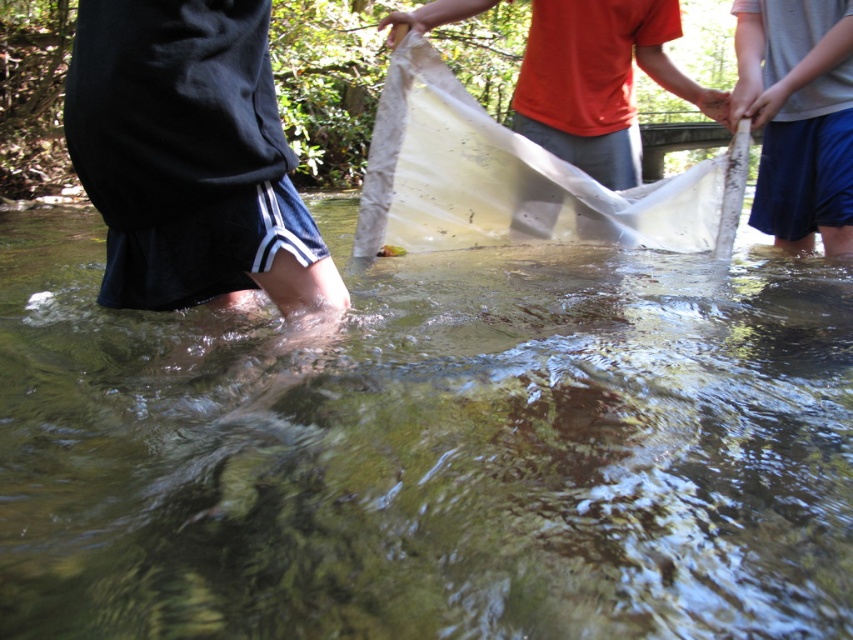
Describe the element at coordinates (430, 452) in the screenshot. The image size is (853, 640). I see `clear water at lower center` at that location.

Which is behind, point (39, 515) or point (711, 113)?

The point (711, 113) is more distant.

What do you see at coordinates (430, 452) in the screenshot?
I see `clear water at lower center` at bounding box center [430, 452].

Image resolution: width=853 pixels, height=640 pixels. I want to click on clear water at lower center, so click(430, 452).

Can you confirm if clear water at lower center is smaller than transparent plastic net at center?

No.

Is clear water at lower center behind transparent plastic net at center?

No, clear water at lower center is closer to the viewer.

What do you see at coordinates (430, 452) in the screenshot? This screenshot has height=640, width=853. I see `clear water at lower center` at bounding box center [430, 452].

You are a GUI agent. You are given a task and a screenshot of the screen. Output one action in this format:
    pyautogui.click(x=<x>, y=<y>)
    Task: Click on the clear water at lower center
    This screenshot has height=640, width=853.
    Given the screenshot: What is the action you would take?
    pyautogui.click(x=430, y=452)

Does transparent plastic net at center have a greater height compared to smooth skin hand at upper center?

Indeed, transparent plastic net at center has a greater height compared to smooth skin hand at upper center.

Find the location of a particular element. transparent plastic net at center is located at coordinates (593, 81).